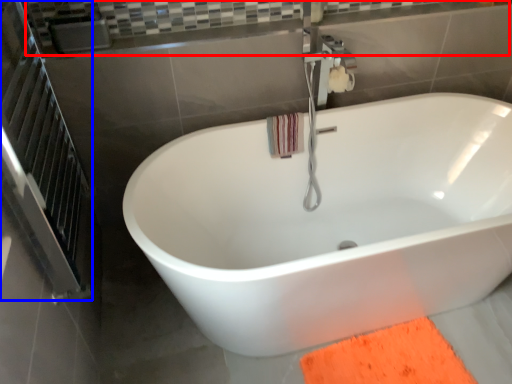
Question: Which object is further to the camera taking this photo, balustrade (highlighted by a red box) or screen door (highlighted by a blue box)?

Choices:
 (A) balustrade
 (B) screen door

Answer: (A)